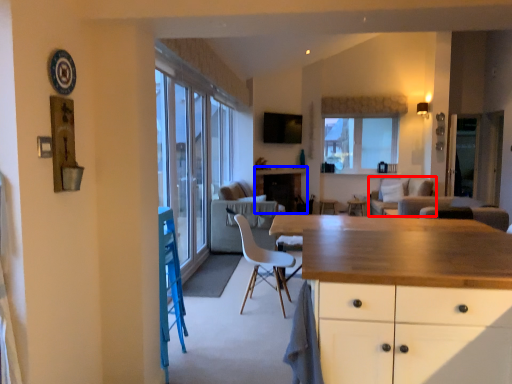
Question: Which of the following is the closest to the observer, couch (highlighted by a red box) or counter (highlighted by a blue box)?

Choices:
 (A) couch
 (B) counter

Answer: (A)